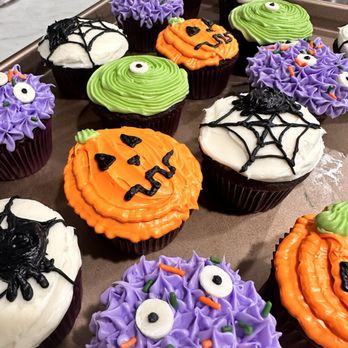
Where is `baking pan`? This screenshot has width=348, height=348. baking pan is located at coordinates (68, 133).